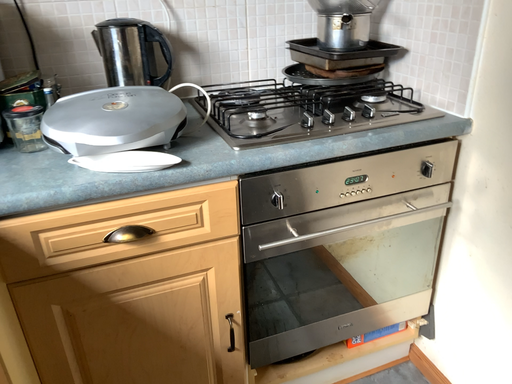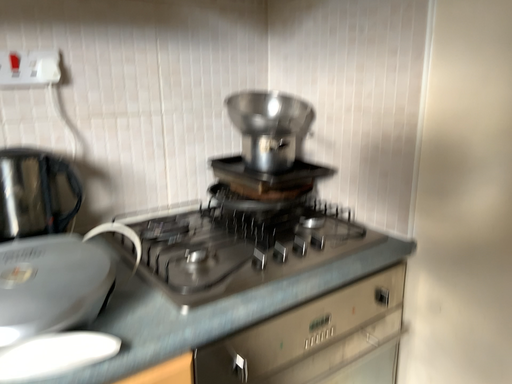
Question: Which way did the camera rotate in the video?

Choices:
 (A) rotated downward
 (B) rotated upward

Answer: (B)